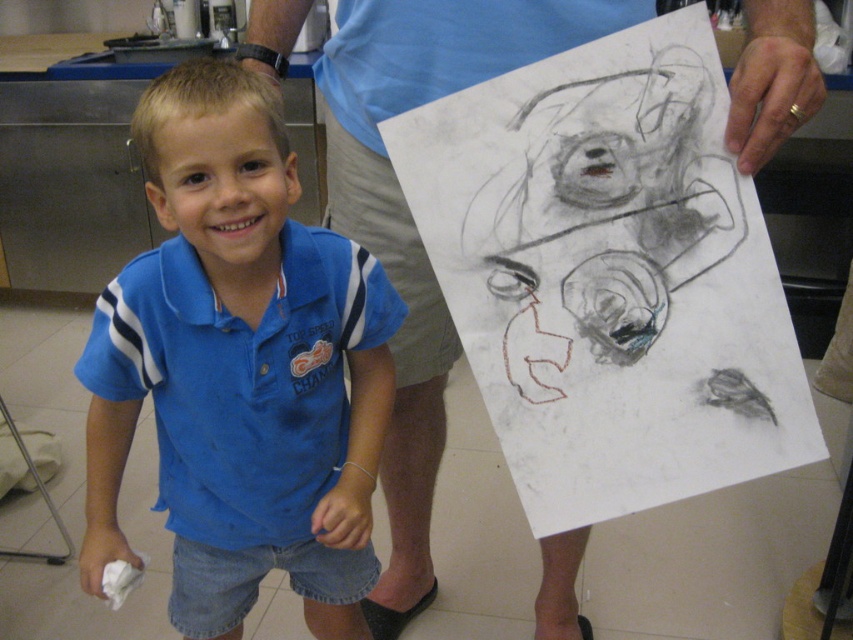
The boy is wearing a blue cotton shirt at center and a blue cotton shirt at upper center. How far apart are the two shirts?

The distance between the blue cotton shirt at center and the blue cotton shirt at upper center is 10.99 inches.

From the picture: The boy is wearing a blue cotton shirt at upper center and holding a charcoal sketch at upper center. Which object is wider?

The blue cotton shirt at upper center is wider than the charcoal sketch at upper center.